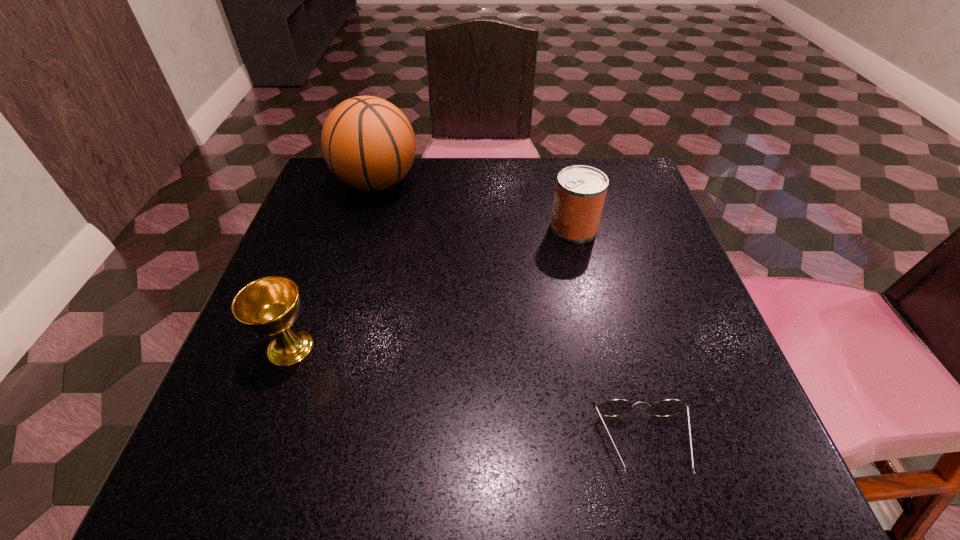
Identify the location of the tallest object. The height and width of the screenshot is (540, 960). (367, 142).

Identify the location of basketball. (367, 142).

You are a GUI agent. You are given a task and a screenshot of the screen. Output one action in this format:
    pyautogui.click(x=<x>, y=<y>)
    Task: Click on the can
    Image resolution: width=960 pixels, height=540 pixels.
    Given the screenshot: What is the action you would take?
    pyautogui.click(x=580, y=192)

Find the location of a particular element. chalice is located at coordinates (268, 306).

You are a GUI agent. You are given a task and a screenshot of the screen. Output one action in this format:
    pyautogui.click(x=<x>, y=<y>)
    Task: Click on the spectacles
    The height and width of the screenshot is (540, 960).
    Given the screenshot: What is the action you would take?
    615,407

At what (x,y) coordinates should I click in order to perform the action: click on the nearest object. Please return your answer as a coordinate pair (x, y). Looking at the image, I should click on (615, 407).

Locate an element on the screen. vacant region located on the right of the farthest object is located at coordinates (564, 182).

Where is `vacant space located on the left of the third nearest object`? vacant space located on the left of the third nearest object is located at coordinates (447, 227).

You are a GUI agent. You are given a task and a screenshot of the screen. Output one action in this format:
    pyautogui.click(x=<x>, y=<y>)
    Task: Click on the free location located 0.310m on the right of the chalice
    
    Given the screenshot: What is the action you would take?
    click(x=499, y=347)

At what (x,y) coordinates should I click in order to perform the action: click on basketball present at the far edge. Please return your answer as a coordinate pair (x, y). Looking at the image, I should click on (367, 142).